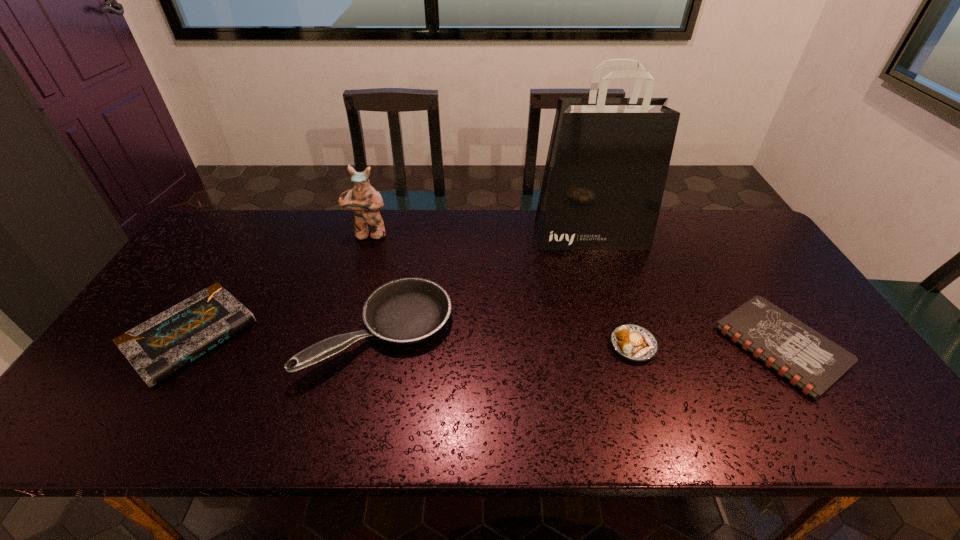
In order to click on blank space at the left edge of the desktop in this screenshot , I will do `click(235, 259)`.

Identify the location of free space at the near right corner. (886, 408).

Locate an element on the screen. The height and width of the screenshot is (540, 960). vacant area between the shortest object and the figurine is located at coordinates (575, 291).

What are the coordinates of `free space between the frying pan and the tallest object` in the screenshot? It's located at (486, 284).

This screenshot has height=540, width=960. Identify the location of unoccupied area between the tallest object and the right notebook. (686, 291).

The width and height of the screenshot is (960, 540). What are the coordinates of `free space between the shortest object and the frying pan` in the screenshot? It's located at (581, 339).

Where is `vacant region between the rightmost object and the tallest object`? The image size is (960, 540). vacant region between the rightmost object and the tallest object is located at coordinates (686, 291).

Identify the location of free space between the shortest object and the third tallest object. (581, 339).

Where is `unoccupied area between the frying pan and the fifth shortest object`? The width and height of the screenshot is (960, 540). unoccupied area between the frying pan and the fifth shortest object is located at coordinates (374, 283).

Where is `empty location between the taller notebook and the fifth shortest object`? The height and width of the screenshot is (540, 960). empty location between the taller notebook and the fifth shortest object is located at coordinates (279, 285).